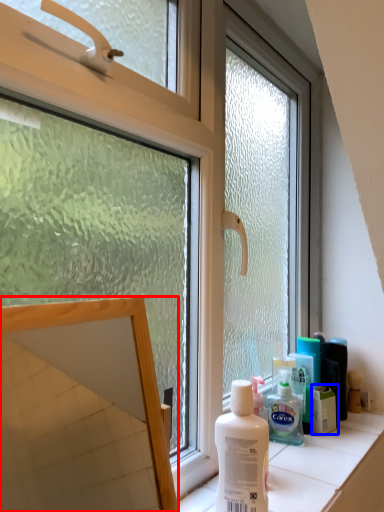
Question: Among these objects, which one is nearest to the camera, mirror (highlighted by a red box) or product (highlighted by a blue box)?

Choices:
 (A) mirror
 (B) product

Answer: (A)